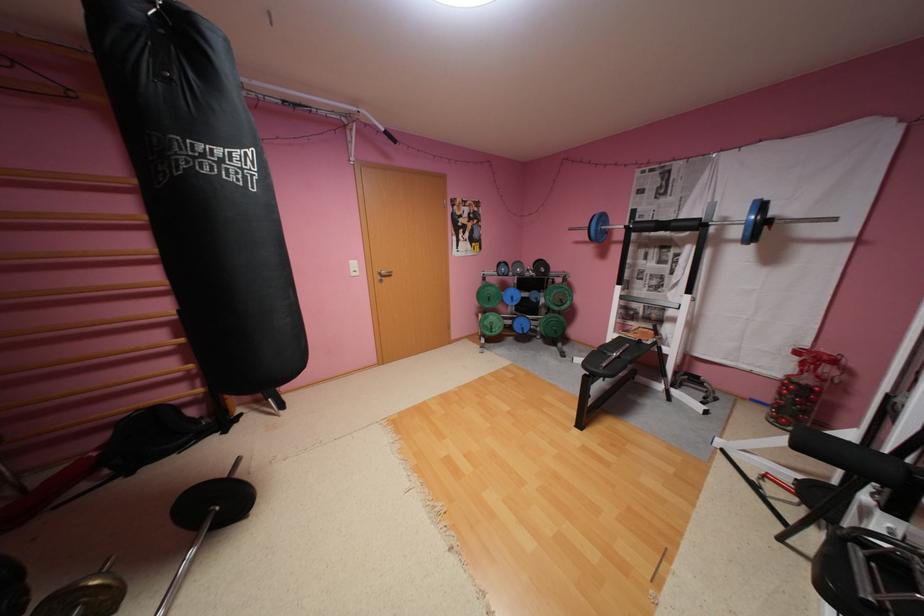
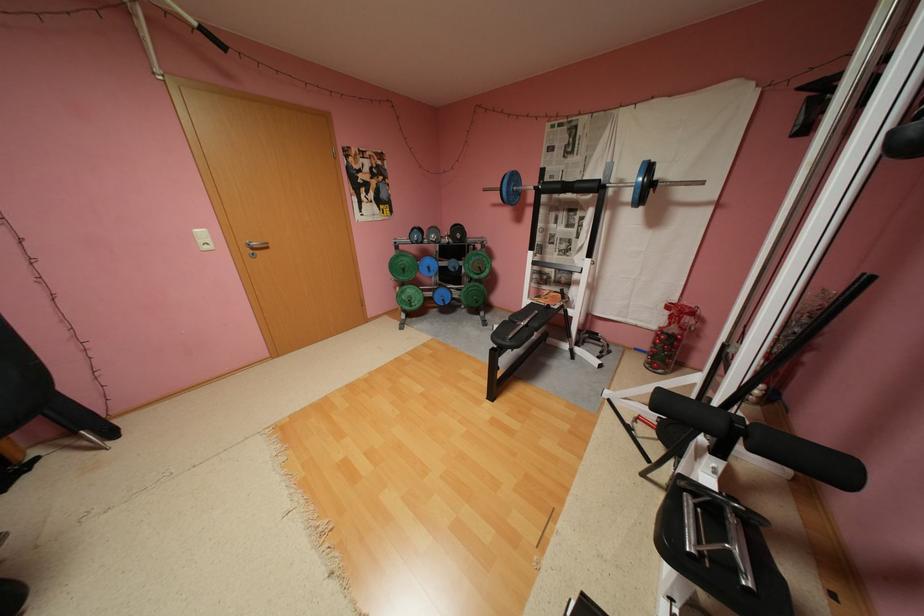
Question: I am providing you with two images of the same scene from different viewpoints. Please identify which objects are invisible in image2.

Choices:
 (A) white light switch
 (B) barbell bar
 (C) barbell spring collar
 (D) none of these

Answer: (D)